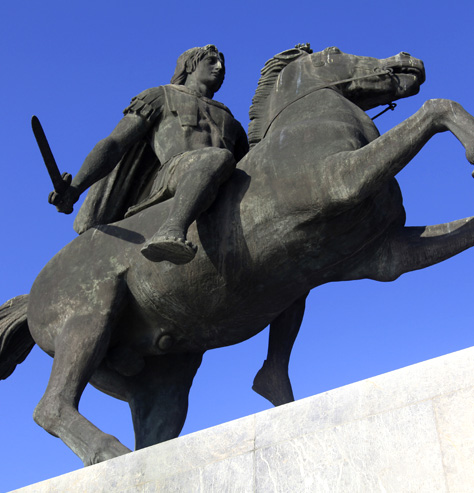
Locate an element on the screen. The image size is (474, 493). right front leg of horse statue is located at coordinates (408, 140).